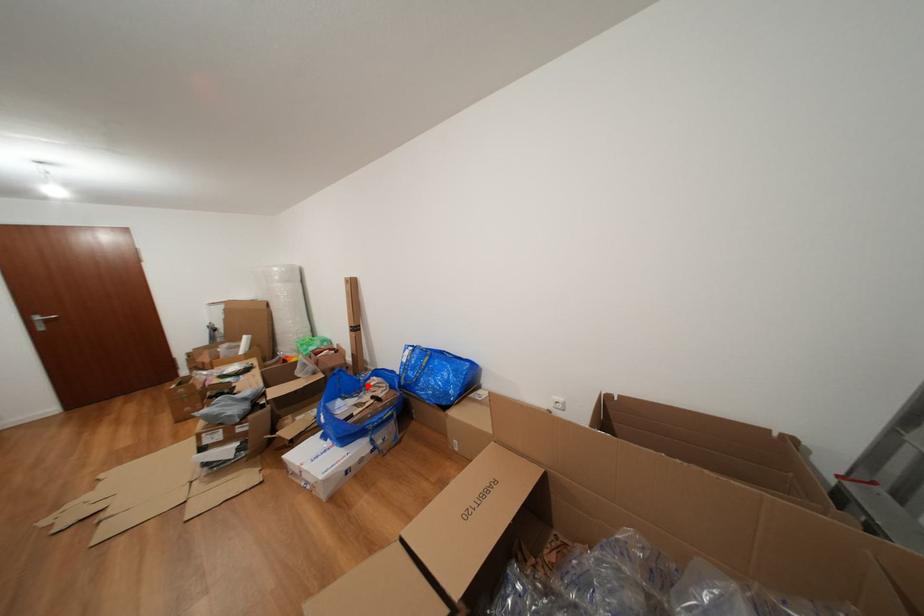
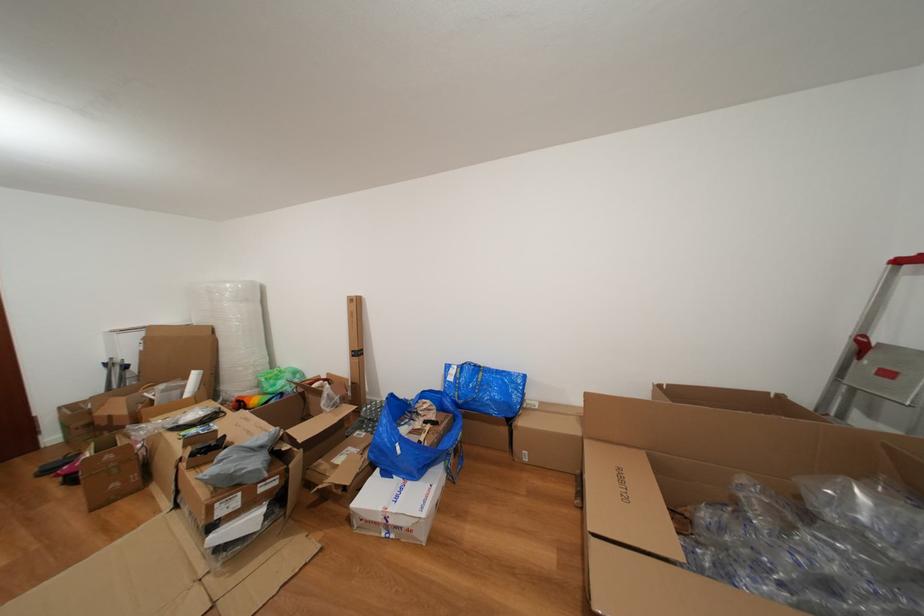
Locate, in the second image, the point that corresponds to the highlighted location in the first image.

(418, 410)